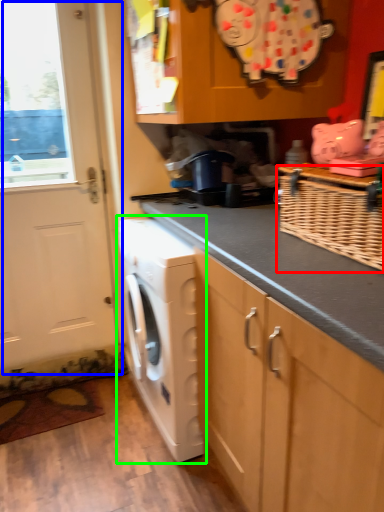
Question: Estimate the real-world distances between objects in this image. Which object is closer to basket (highlighted by a red box), door (highlighted by a blue box) or washing machine (highlighted by a green box)?

Choices:
 (A) door
 (B) washing machine

Answer: (B)